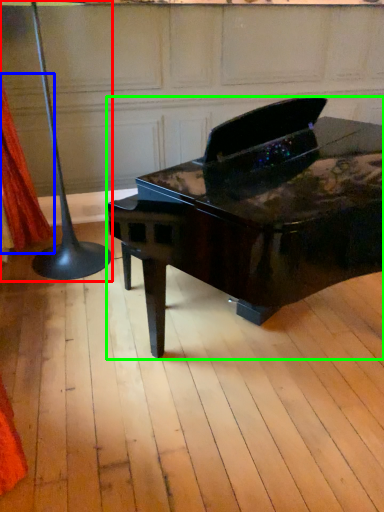
Question: Which object is positioned farthest from table lamp (highlighted by a red box)? Select from curtain (highlighted by a blue box) and piano (highlighted by a green box).

Choices:
 (A) curtain
 (B) piano

Answer: (B)